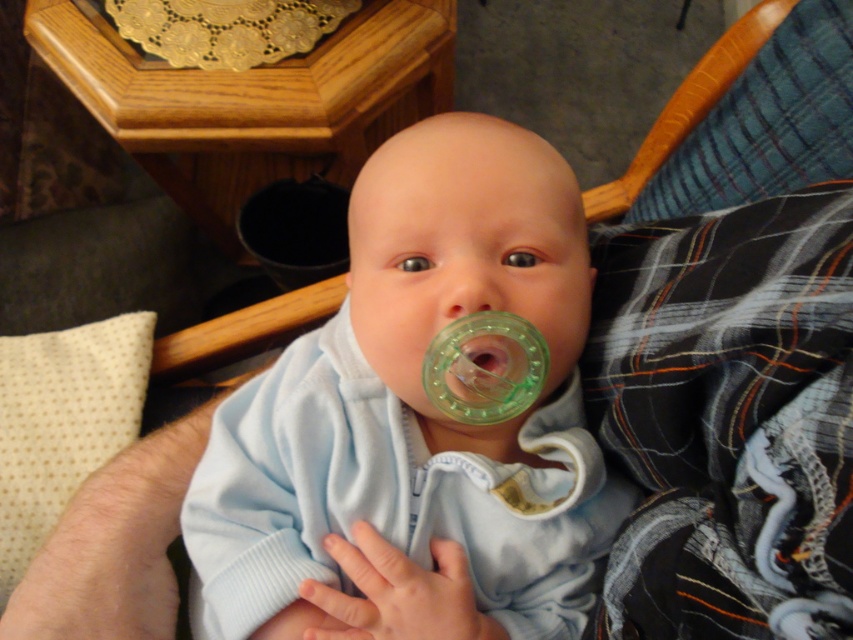
Is light blue fabric baby at center to the left of green translucent pacifier at center from the viewer's perspective?

Indeed, light blue fabric baby at center is positioned on the left side of green translucent pacifier at center.

Between light blue fabric baby at center and green translucent pacifier at center, which one is positioned lower?

light blue fabric baby at center is below.

Is point (422, 264) less distant than point (503, 349)?

No, (422, 264) is behind (503, 349).

Where is `light blue fabric baby at center`? The image size is (853, 640). light blue fabric baby at center is located at coordinates (415, 422).